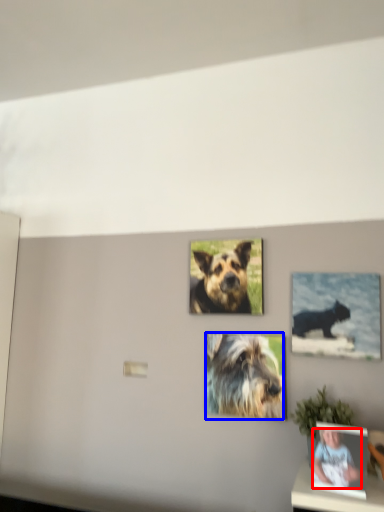
Question: Which object appears farthest to the camera in this image, person (highlighted by a red box) or dog (highlighted by a blue box)?

Choices:
 (A) person
 (B) dog

Answer: (B)